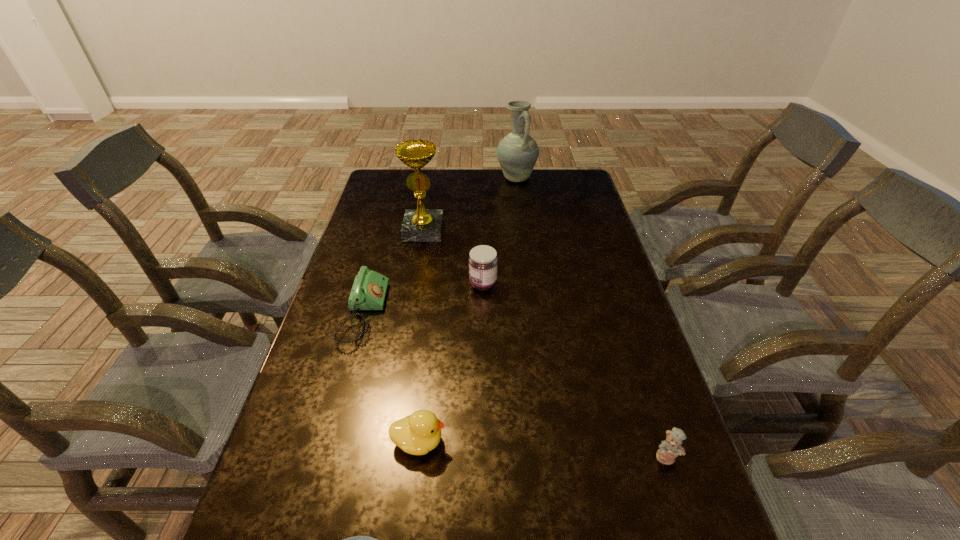
Identify the location of vacant space in between the duckling and the jam. (451, 363).

Find the location of a particular element. object that ranks as the third closest to the duckling is located at coordinates (483, 260).

At what (x,y) coordinates should I click in order to perform the action: click on object that is the closest one to the nearest object. Please return your answer as a coordinate pair (x, y). The image size is (960, 540). Looking at the image, I should click on (417, 434).

In order to click on vacant space that satisfies the following two spatial constraints: 1. on the handle side of the farthest object; 2. on the dial of the telephone in this screenshot , I will do `click(533, 313)`.

Image resolution: width=960 pixels, height=540 pixels. Identify the location of vacant position in the image that satisfies the following two spatial constraints: 1. on the front-facing side of the award; 2. on the dial of the telephone. (410, 313).

Locate an element on the screen. The height and width of the screenshot is (540, 960). vacant region that satisfies the following two spatial constraints: 1. on the front-facing side of the award; 2. on the dial of the telephone is located at coordinates (410, 313).